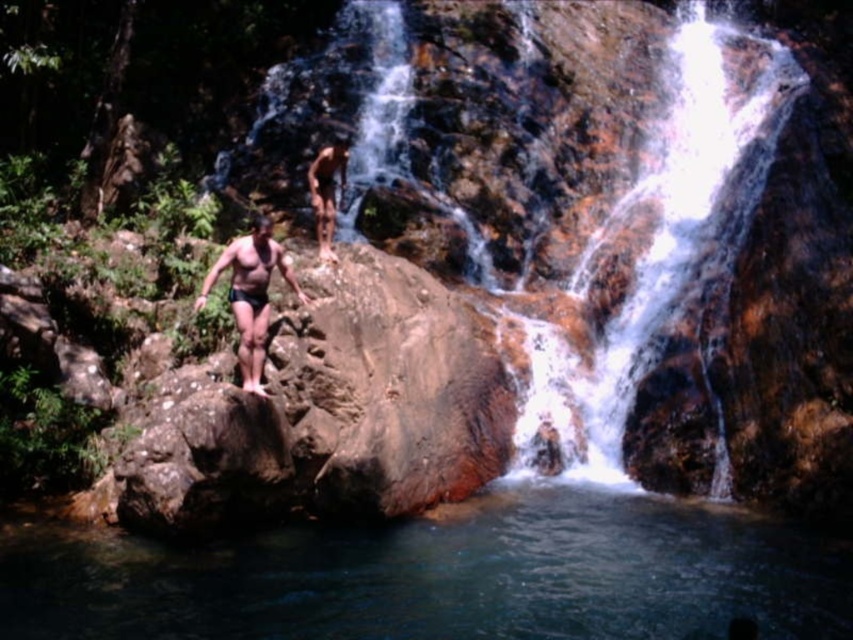
Question: Which object appears farthest from the camera in this image?

Choices:
 (A) matte black shorts at center
 (B) smooth skin man at center
 (C) translucent wet rock at center
 (D) clear blue water at center

Answer: (C)

Question: Which of these objects is positioned closest to the translucent wet rock at center?

Choices:
 (A) matte black shorts at center
 (B) clear blue water at center
 (C) smooth skin man at center

Answer: (B)

Question: Does clear blue water at center appear under matte black shorts at center?

Choices:
 (A) no
 (B) yes

Answer: (B)

Question: Is matte black shorts at center further to the viewer compared to smooth skin man at center?

Choices:
 (A) no
 (B) yes

Answer: (A)

Question: Based on their relative distances, which object is nearer to the matte black shorts at center?

Choices:
 (A) clear blue water at center
 (B) translucent wet rock at center

Answer: (A)

Question: Is translucent wet rock at center in front of smooth skin man at center?

Choices:
 (A) no
 (B) yes

Answer: (A)